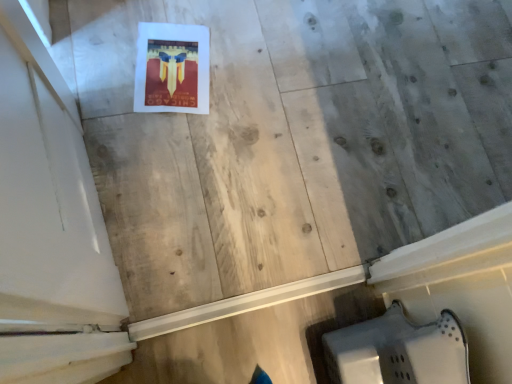
Question: Should I look upward or downward to see white matte door at upper left?

Choices:
 (A) up
 (B) down

Answer: (A)